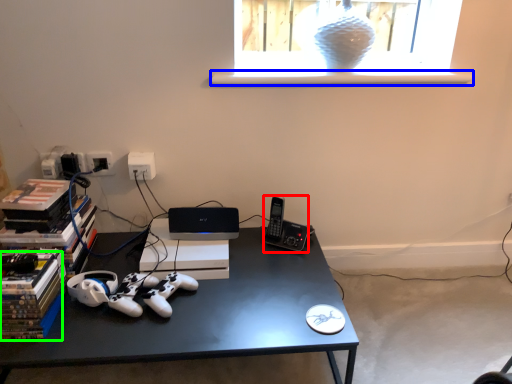
Question: Estimate the real-world distances between objects in this image. Which object is closer to gadget (highlighted by a red box), window sill (highlighted by a blue box) or paperback book (highlighted by a green box)?

Choices:
 (A) window sill
 (B) paperback book

Answer: (A)